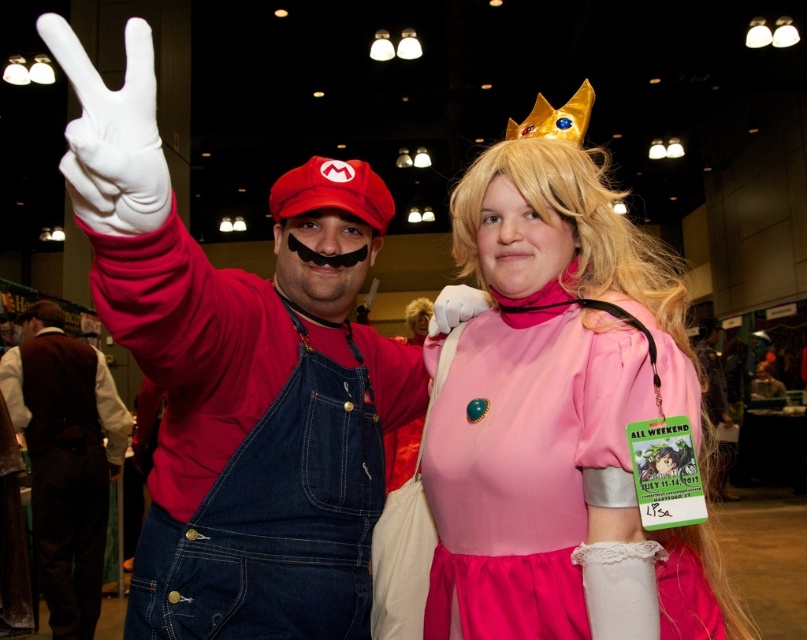
You are a photographer at the event and need to capture a closeup shot of both the white latex glove at upper left and the white matte glove at upper center in the same frame. Given that your camera has a focal length of 50mm and a sensor size of 24x36mm, what is the minimum distance you need to stand from the gloves to ensure both are fully visible in the frame?

The white latex glove at upper left is 33.61 inches away from the white matte glove at upper center. To capture both in a 50mm focal length with a 24x36mm sensor, the minimum distance required would be calculated using the formula for field of view. The horizontal FOV at 50mm is approximately 39.6 degrees. Using trigonometry, the distance needed to cover 33.61 inches within this angle would be roughly 33.61 divided by tanh of half the angle. This results in approximately 42 inches away from the gloves.

You are standing in front of the Mario and Princess Peach cosplayers at the convention. There are two points marked in the image. Which point, point 1 at coordinates (128, 220) or point 2 at (471, 301), is closer to you?

Point 1 at coordinates (128, 220) is closer to the viewer than point 2 at (471, 301).

Based on the photo, you are at a cosplay event and want to take a photo of both Mario and Princess Peach. You notice two points marked in the image. Which point, point 1 at coordinates [668,275] or point 2 at coordinates [592,92], is closer to you?

Point 1 at coordinates [668,275] is closer to the viewer than point 2 at coordinates [592,92].